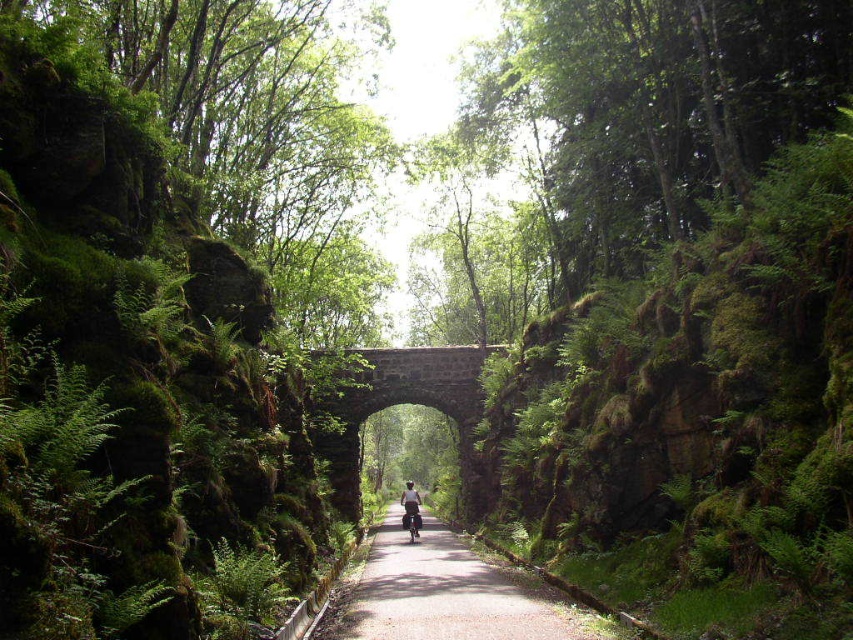
Does point (498, 582) lie behind point (367, 381)?

That is False.

Who is more forward, (387, 586) or (466, 428)?

Positioned in front is point (387, 586).

Between point (341, 595) and point (476, 481), which one is positioned behind?

The point (476, 481) is more distant.

Where is `smooth asphalt path at center`? smooth asphalt path at center is located at coordinates (445, 593).

Between point (350, 609) and point (407, 516), which one is positioned in front?

Point (350, 609) is in front.

Between smooth asphalt path at center and metallic silver motorbike at center, which one appears on the right side from the viewer's perspective?

smooth asphalt path at center

Does point (445, 554) come behind point (421, 522)?

No, it is in front of (421, 522).

Find the location of a particular element. smooth asphalt path at center is located at coordinates (445, 593).

Is stone archway at center to the right of metallic silver motorbike at center from the viewer's perspective?

Correct, you'll find stone archway at center to the right of metallic silver motorbike at center.

Which of these two, stone archway at center or metallic silver motorbike at center, stands shorter?

Standing shorter between the two is metallic silver motorbike at center.

Between point (343, 467) and point (416, 500), which one is positioned in front?

Positioned in front is point (416, 500).

Locate an element on the screen. Image resolution: width=853 pixels, height=640 pixels. stone archway at center is located at coordinates (402, 403).